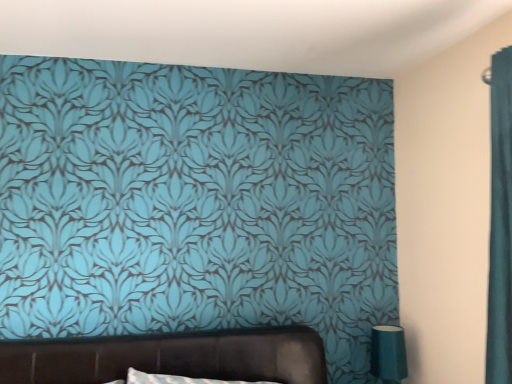
Where is `teal glossy table lamp at lower right`? Image resolution: width=512 pixels, height=384 pixels. teal glossy table lamp at lower right is located at coordinates (388, 353).

What do you see at coordinates (388, 353) in the screenshot? I see `teal glossy table lamp at lower right` at bounding box center [388, 353].

You are a GUI agent. You are given a task and a screenshot of the screen. Output one action in this format:
    pyautogui.click(x=<x>, y=<y>)
    Task: Click on the brown leather bed at center
    This screenshot has width=512, height=384.
    Given the screenshot: What is the action you would take?
    pyautogui.click(x=169, y=357)

The width and height of the screenshot is (512, 384). Describe the element at coordinates (169, 357) in the screenshot. I see `brown leather bed at center` at that location.

Measure the distance between point (83, 371) and camera.

The depth of point (83, 371) is 1.75 meters.

In order to click on teal glossy table lamp at lower right in this screenshot , I will do `click(388, 353)`.

Can you confirm if brown leather bed at center is positioned to the left of teal glossy table lamp at lower right?

Correct, you'll find brown leather bed at center to the left of teal glossy table lamp at lower right.

Is brown leather bed at center closer to the viewer compared to teal glossy table lamp at lower right?

Yes, it is in front of teal glossy table lamp at lower right.

Is point (298, 335) closer to camera compared to point (383, 372)?

Yes.

From the image's perspective, is brown leather bed at center on teal glossy table lamp at lower right?

Yes, from the image's perspective, brown leather bed at center is above teal glossy table lamp at lower right.

From a real-world perspective, which is physically below, brown leather bed at center or teal glossy table lamp at lower right?

From a 3D spatial view, teal glossy table lamp at lower right is below.

Considering the sizes of brown leather bed at center and teal glossy table lamp at lower right in the image, is brown leather bed at center wider or thinner than teal glossy table lamp at lower right?

Clearly, brown leather bed at center has more width compared to teal glossy table lamp at lower right.

From the picture: Can you confirm if brown leather bed at center is taller than teal glossy table lamp at lower right?

Indeed, brown leather bed at center has a greater height compared to teal glossy table lamp at lower right.

Does brown leather bed at center have a larger size compared to teal glossy table lamp at lower right?

Correct, brown leather bed at center is larger in size than teal glossy table lamp at lower right.

Consider the image. Which is correct: brown leather bed at center is inside teal glossy table lamp at lower right, or outside of it?

brown leather bed at center is spatially situated outside teal glossy table lamp at lower right.

Is brown leather bed at center next to teal glossy table lamp at lower right?

There is a gap between brown leather bed at center and teal glossy table lamp at lower right.

Is teal glossy table lamp at lower right at the back of brown leather bed at center?

No.

What's the angular difference between brown leather bed at center and teal glossy table lamp at lower right's facing directions?

There is a 1.31-degree angle between the facing directions of brown leather bed at center and teal glossy table lamp at lower right.

This screenshot has height=384, width=512. In order to click on table lamp on the right of brown leather bed at center in this screenshot , I will do `click(388, 353)`.

Would you say teal glossy table lamp at lower right is to the left or to the right of brown leather bed at center in the picture?

In the image, teal glossy table lamp at lower right appears on the right side of brown leather bed at center.

Is the depth of teal glossy table lamp at lower right greater than that of brown leather bed at center?

Yes, teal glossy table lamp at lower right is further from the viewer.

Considering the positions of point (375, 356) and point (309, 337), is point (375, 356) closer or farther from the camera than point (309, 337)?

Point (375, 356) appears to be farther away from the viewer than point (309, 337).

From the image's perspective, is teal glossy table lamp at lower right beneath brown leather bed at center?

Yes.

From a real-world perspective, which is physically below, teal glossy table lamp at lower right or brown leather bed at center?

teal glossy table lamp at lower right, from a real-world perspective.

Which object is thinner, teal glossy table lamp at lower right or brown leather bed at center?

Thinner between the two is teal glossy table lamp at lower right.

Which of these two, teal glossy table lamp at lower right or brown leather bed at center, stands shorter?

teal glossy table lamp at lower right.

Which of these two, teal glossy table lamp at lower right or brown leather bed at center, is bigger?

brown leather bed at center.

Is teal glossy table lamp at lower right outside of brown leather bed at center?

Indeed, teal glossy table lamp at lower right is completely outside brown leather bed at center.

Is teal glossy table lamp at lower right placed right next to brown leather bed at center?

teal glossy table lamp at lower right and brown leather bed at center are clearly separated.

Is teal glossy table lamp at lower right positioned with its back to brown leather bed at center?

teal glossy table lamp at lower right does not have its back to brown leather bed at center.

What are the coordinates of `table lamp that appears on the right of brown leather bed at center` in the screenshot? It's located at (388, 353).

Where is `furniture in front of the teal glossy table lamp at lower right`? furniture in front of the teal glossy table lamp at lower right is located at coordinates (169, 357).

Where is `furniture above the teal glossy table lamp at lower right (from the image's perspective)`? The width and height of the screenshot is (512, 384). furniture above the teal glossy table lamp at lower right (from the image's perspective) is located at coordinates (169, 357).